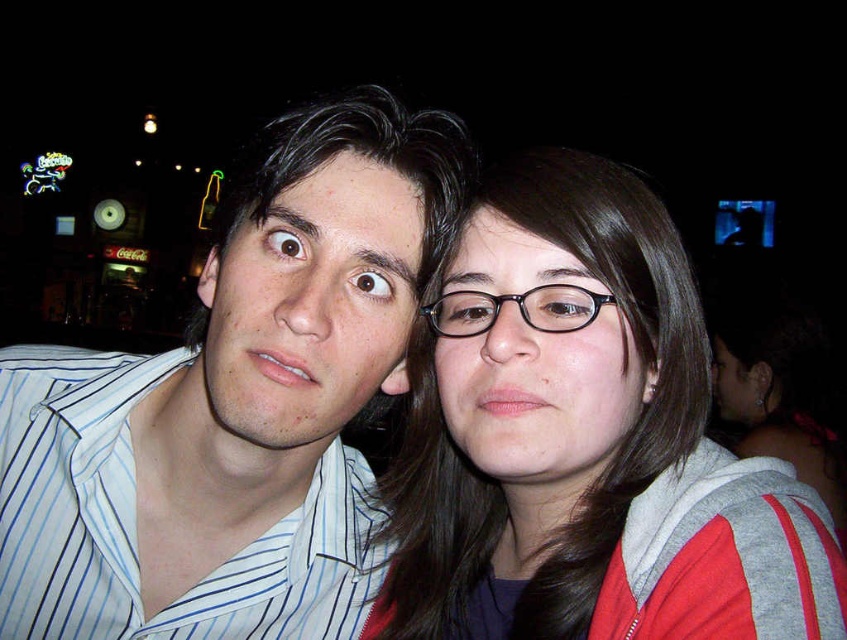
You are taking a photo of two people in a dimly lit area at night. You notice two points of light in the scene, one at point (401, 131) and another at point (580, 316). Which point is closer to your camera lens?

Point (401, 131) is closer to the camera lens because it is further to the viewer than point (580, 316).

You are a photographer setting up a shot for the two people in the image. You need to adjust the camera focus so that both the white striped shirt at left and the black plastic glasses at center are in focus. Given their heights, which object should you focus on to ensure both are sharp?

The white striped shirt at left is much taller than the black plastic glasses at center. To ensure both are in focus, you should focus on the white striped shirt at left since it is farther away from the camera.